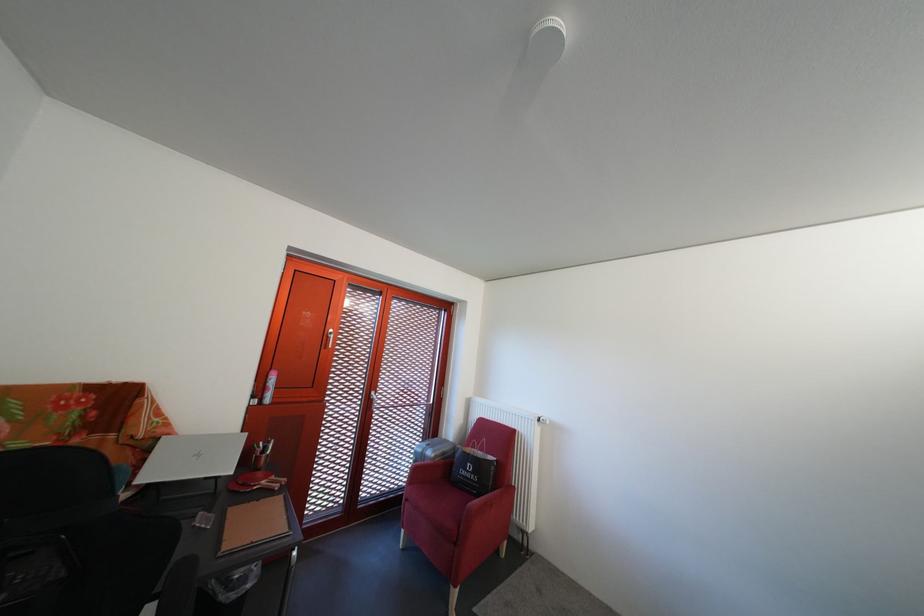
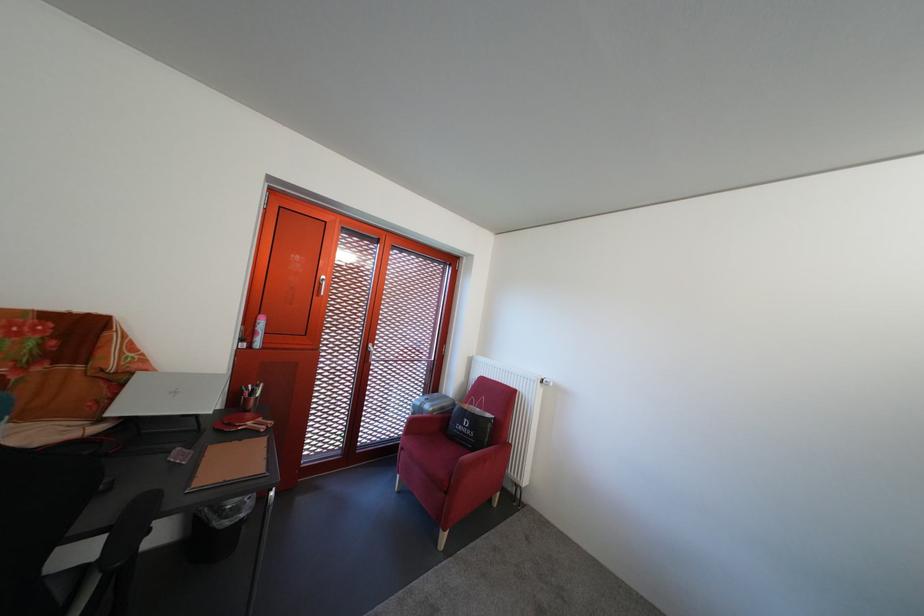
Locate, in the second image, the point that corresponds to (441,459) in the first image.

(439, 413)